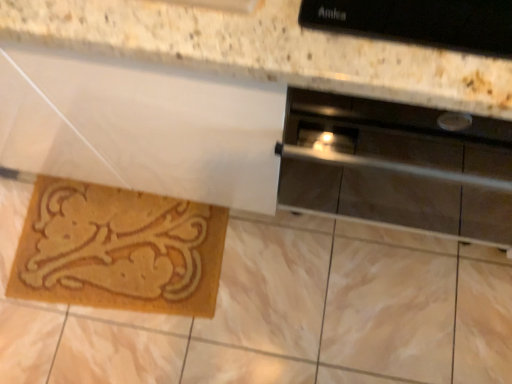
What are the coordinates of `free location in front of natural fiber mat at lower left` in the screenshot? It's located at tap(119, 347).